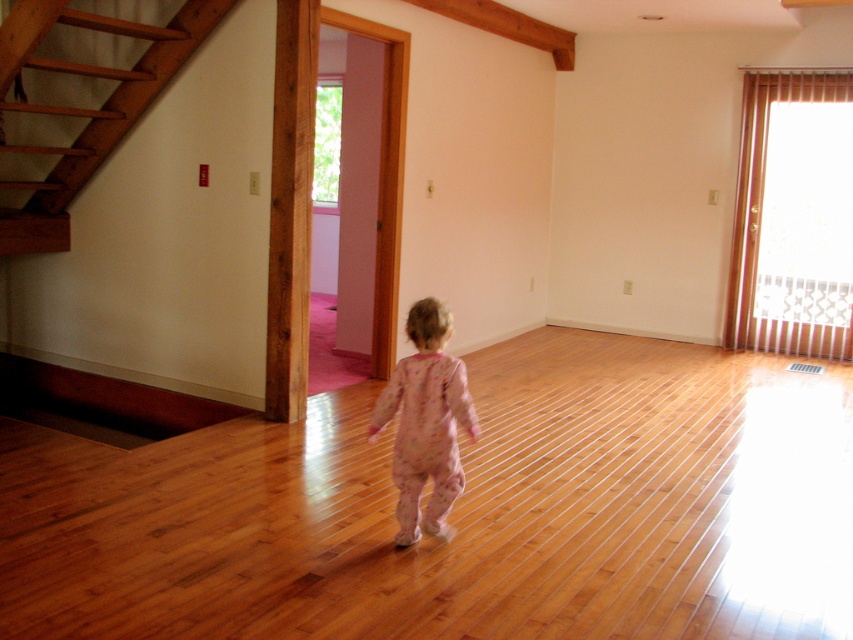
Can you confirm if wooden stairs at left is thinner than pink cotton pajamas at center?

Incorrect, wooden stairs at left's width is not less than pink cotton pajamas at center's.

Find the location of a particular element. wooden stairs at left is located at coordinates (78, 99).

Who is more forward, (10, 74) or (424, 452)?

Point (424, 452) is more forward.

The width and height of the screenshot is (853, 640). In order to click on wooden stairs at left in this screenshot , I will do `click(78, 99)`.